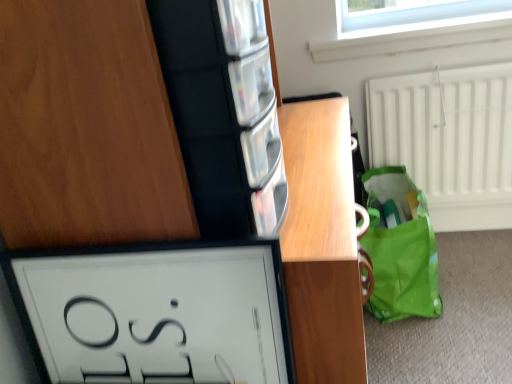
Question: Is white glossy picture frame at lower left inside the boundaries of matte wood cabinet at upper left, or outside?

Choices:
 (A) outside
 (B) inside

Answer: (A)

Question: Considering the positions of white glossy picture frame at lower left and matte wood cabinet at upper left in the image, is white glossy picture frame at lower left wider or thinner than matte wood cabinet at upper left?

Choices:
 (A) wide
 (B) thin

Answer: (B)

Question: Which object is positioned farthest from the wooden vanity at center?

Choices:
 (A) green fabric tote at lower right
 (B) matte wood cabinet at upper left
 (C) clear glass window at upper center
 (D) white glossy picture frame at lower left

Answer: (C)

Question: Which of these objects is positioned farthest from the matte wood cabinet at upper left?

Choices:
 (A) wooden vanity at center
 (B) white glossy picture frame at lower left
 (C) green fabric tote at lower right
 (D) clear glass window at upper center

Answer: (D)